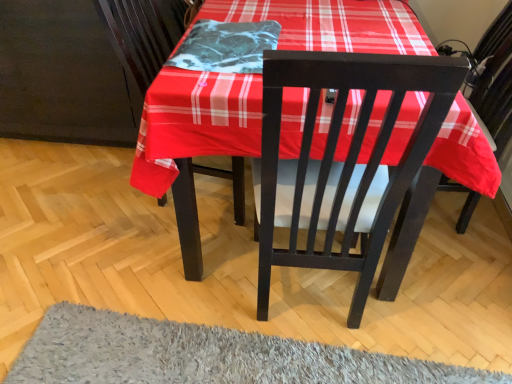
Question: From the image's perspective, is gray shaggy rug at lower center above or below marble-like fabric at center?

Choices:
 (A) above
 (B) below

Answer: (B)

Question: Is gray shaggy rug at lower center taller or shorter than marble-like fabric at center?

Choices:
 (A) tall
 (B) short

Answer: (A)

Question: From a real-world perspective, is gray shaggy rug at lower center above or below marble-like fabric at center?

Choices:
 (A) above
 (B) below

Answer: (B)

Question: From a real-world perspective, relative to gray shaggy rug at lower center, is marble-like fabric at center vertically above or below?

Choices:
 (A) above
 (B) below

Answer: (A)

Question: Is marble-like fabric at center to the left or to the right of gray shaggy rug at lower center in the image?

Choices:
 (A) right
 (B) left

Answer: (B)

Question: In terms of width, does marble-like fabric at center look wider or thinner when compared to gray shaggy rug at lower center?

Choices:
 (A) wide
 (B) thin

Answer: (B)

Question: Is marble-like fabric at center taller or shorter than gray shaggy rug at lower center?

Choices:
 (A) short
 (B) tall

Answer: (A)